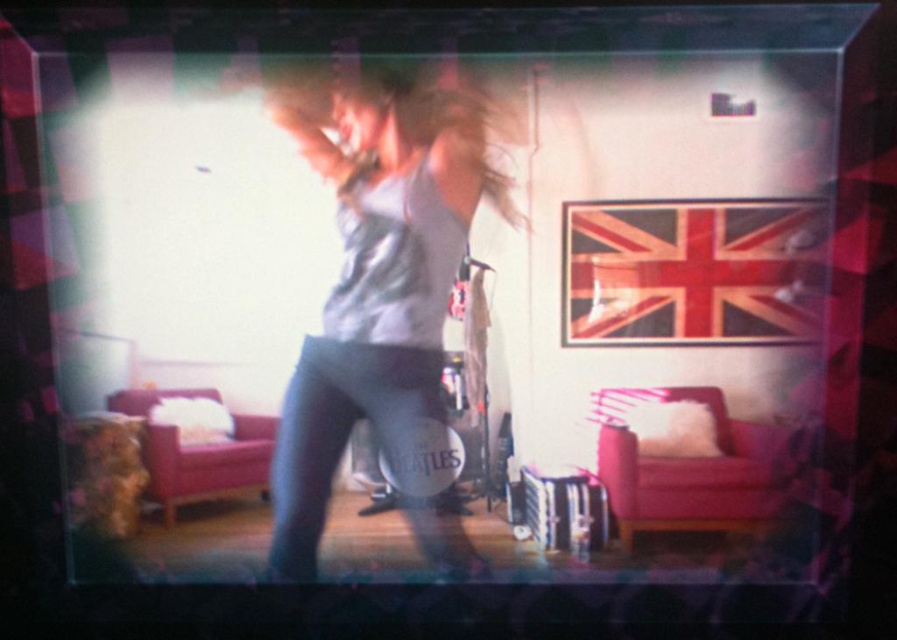
Question: Which of the following is the farthest from the observer?

Choices:
 (A) (431, 241)
 (B) (467, 80)

Answer: (A)

Question: Does gray matte tank top at center have a lesser width compared to blonde silky hair at center?

Choices:
 (A) yes
 (B) no

Answer: (B)

Question: Is gray matte tank top at center bigger than blonde silky hair at center?

Choices:
 (A) yes
 (B) no

Answer: (A)

Question: Can you confirm if gray matte tank top at center is positioned to the right of blonde silky hair at center?

Choices:
 (A) no
 (B) yes

Answer: (A)